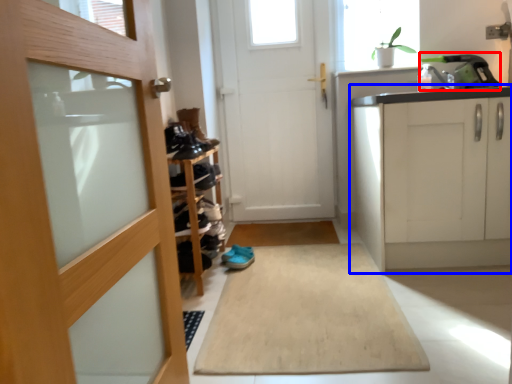
Question: Which point is further to the camera, sink (highlighted by a red box) or cabinetry (highlighted by a blue box)?

Choices:
 (A) sink
 (B) cabinetry

Answer: (A)